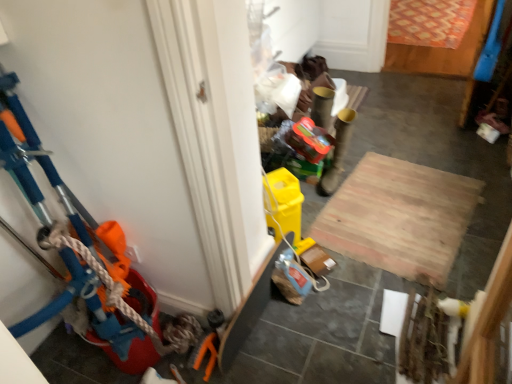
At what (x,y) coordinates should I click in order to perform the action: click on vacant space behind wooden at center. Please return your answer as a coordinate pair (x, y). This screenshot has width=512, height=384. Looking at the image, I should click on (395, 138).